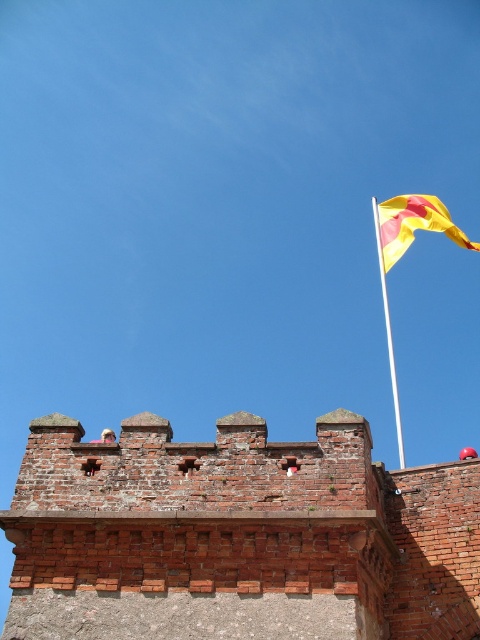
You are a drone operator tasked with flying a drone between the red brick wall at upper center and the yellow fabric flag at upper right. The drone has a maximum flight distance of 30 meters. Can the drone safely complete the flight between these two points?

The red brick wall at upper center and yellow fabric flag at upper right are 35.65 meters apart. Since the drone has a maximum flight distance of 30 meters, it cannot safely complete the flight between these two points as the distance exceeds its capability.

You are standing in front of a historical brick wall with a flagpole on the right. There is a specific point marked at coordinates point (396, 237). If you want to touch this point with a 50 meter long pole, will you be able to reach it?

The point (396, 237) is 49.67 meters from the viewer. Since the pole is 50 meters long, you can just barely reach it with the pole.